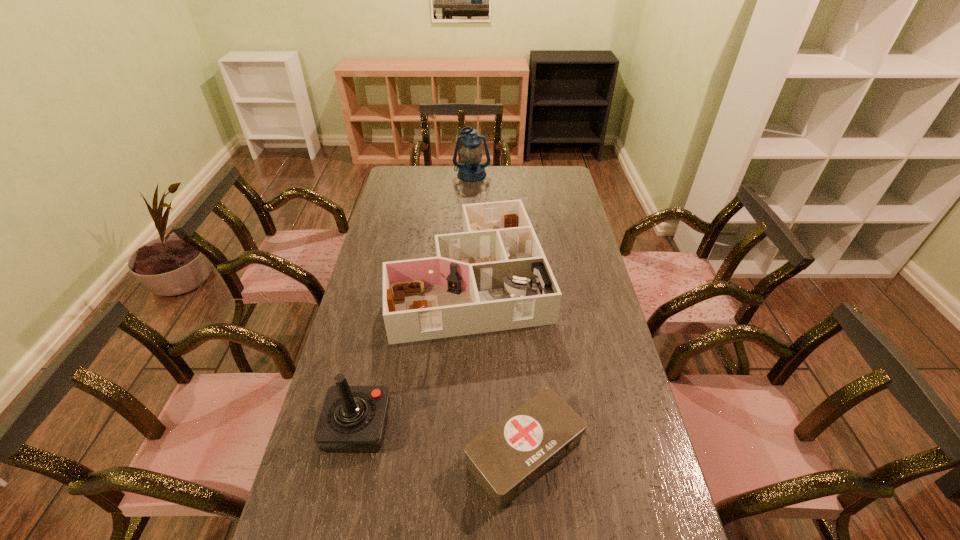
Locate an element on the screen. This screenshot has width=960, height=540. joystick at the left edge is located at coordinates [353, 418].

Identify the location of dollhouse that is positioned at the left edge. This screenshot has height=540, width=960. 493,276.

I want to click on vacant area at the far edge of the desktop, so click(x=472, y=186).

This screenshot has width=960, height=540. Find the location of `vacant area at the left edge of the desktop`. vacant area at the left edge of the desktop is located at coordinates (345, 354).

Locate an element on the screen. This screenshot has width=960, height=540. free space at the right edge of the desktop is located at coordinates (564, 228).

Where is `vacant area that lies between the joystick and the third tallest object`? The height and width of the screenshot is (540, 960). vacant area that lies between the joystick and the third tallest object is located at coordinates (414, 352).

Where is `unoccupied position between the dollhouse and the joystick`? This screenshot has height=540, width=960. unoccupied position between the dollhouse and the joystick is located at coordinates (414, 352).

At what (x,y) coordinates should I click in order to perform the action: click on unoccupied area between the joystick and the shortest object. Please return your answer as a coordinate pair (x, y). The height and width of the screenshot is (540, 960). Looking at the image, I should click on (441, 440).

This screenshot has width=960, height=540. In order to click on unoccupied position between the joystick and the first-aid kit in this screenshot , I will do `click(441, 440)`.

At what (x,y) coordinates should I click in order to perform the action: click on vacant area that lies between the first-aid kit and the second farthest object. Please return your answer as a coordinate pair (x, y). Looking at the image, I should click on (497, 366).